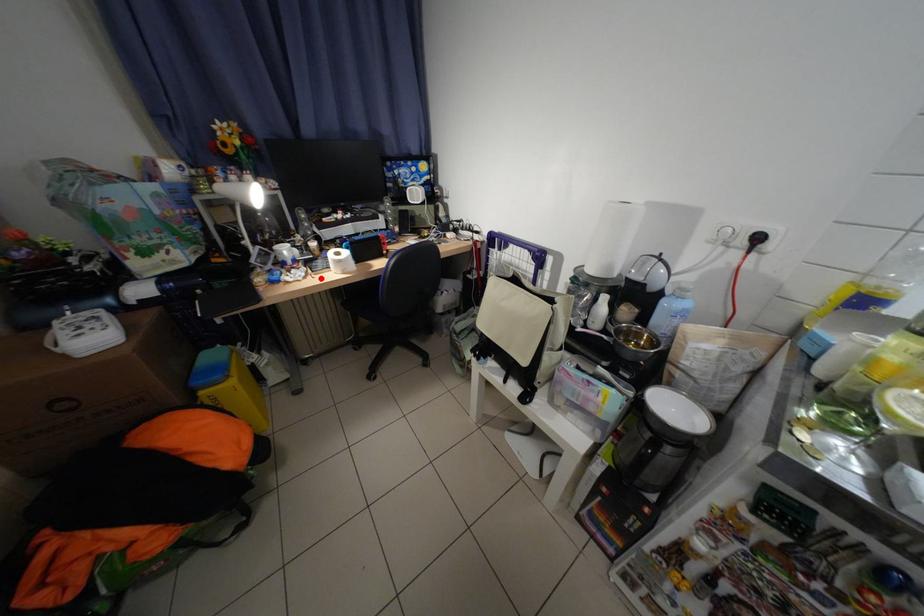
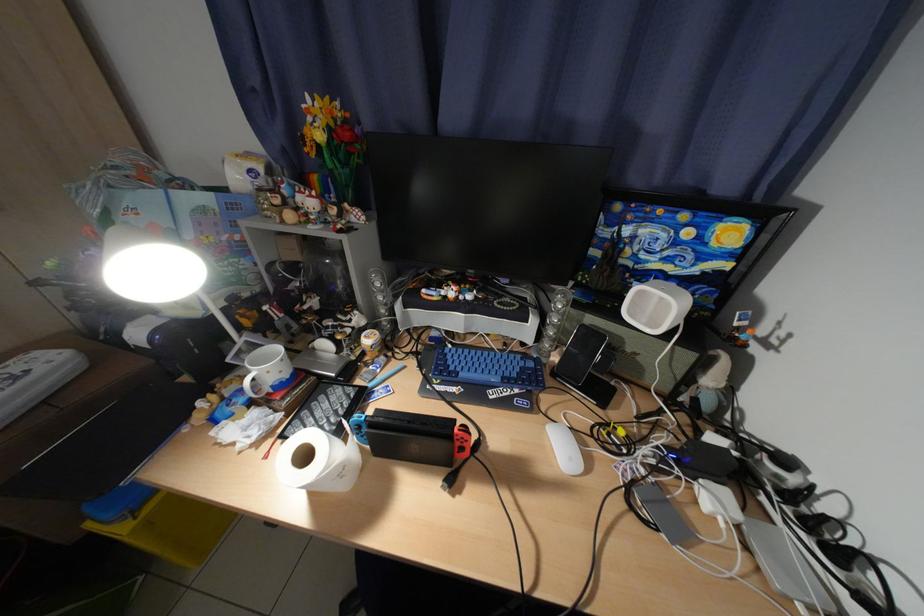
Question: I am providing you with two images of the same scene from different viewpoints. A red point is shown in image1. For the corresponding object point in image2, is it positioned nearer or farther from the camera?

Choices:
 (A) Nearer
 (B) Farther

Answer: (B)